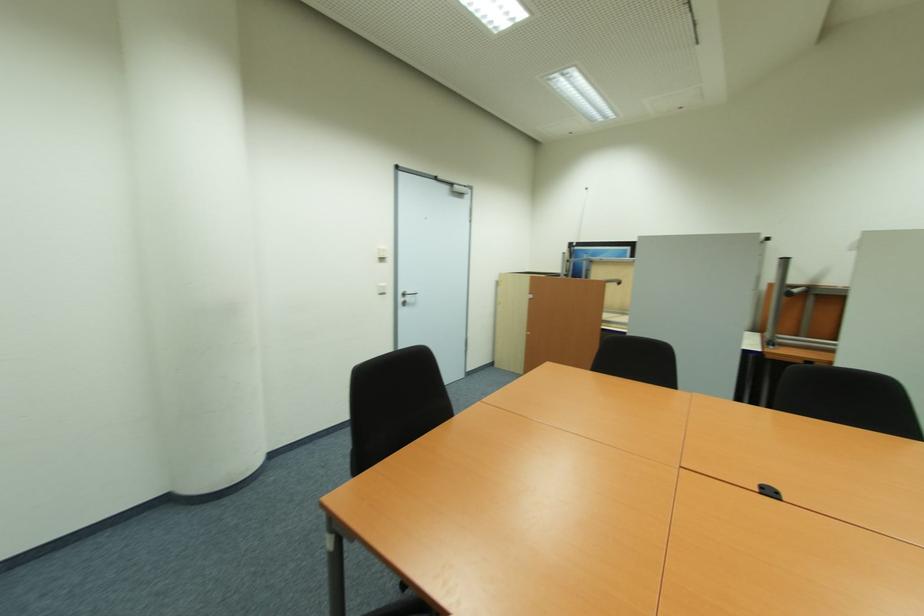
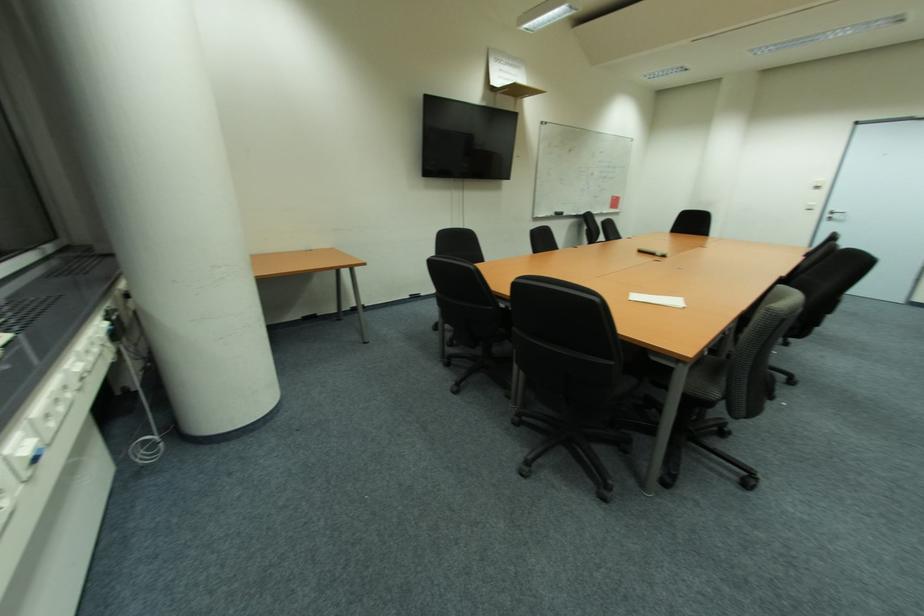
In the second image, find the point that corresponds to point (410, 300) in the first image.

(842, 217)